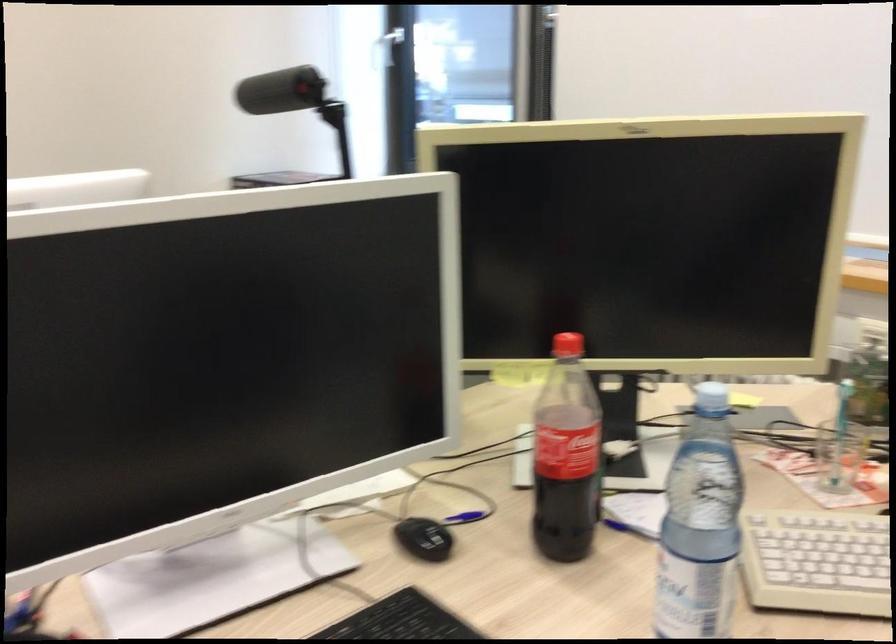
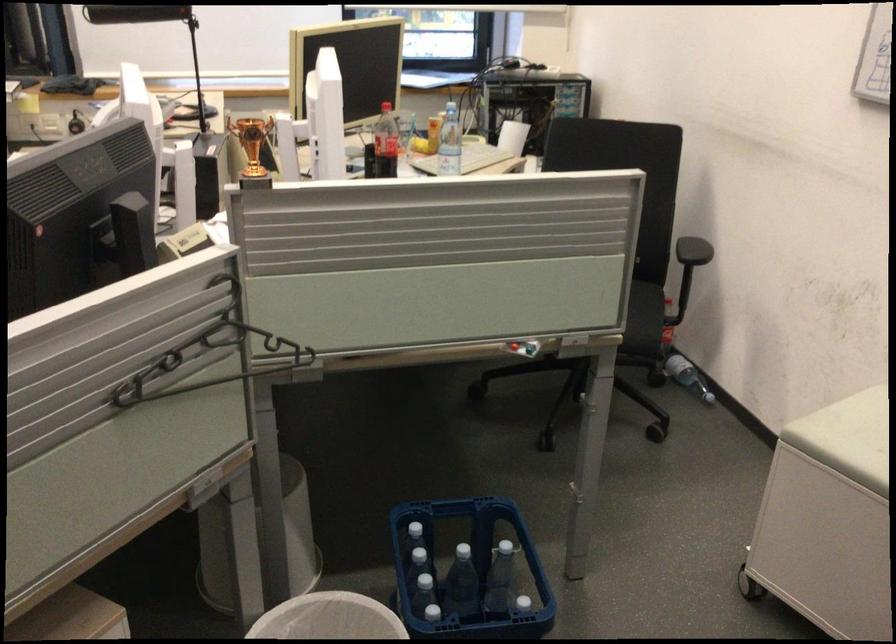
Locate, in the second image, the point that corresponds to (596,453) in the first image.

(385, 143)